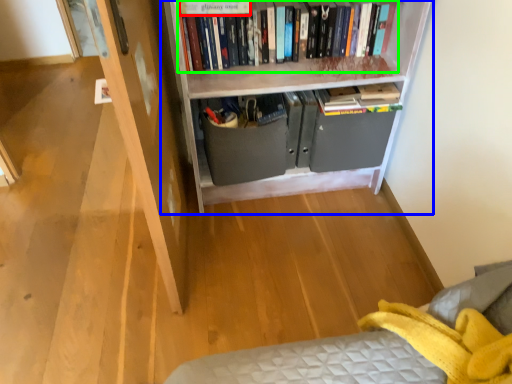
Question: Which is farther away from paperback book (highlighted by a red box)? bookcase (highlighted by a blue box) or book (highlighted by a green box)?

Choices:
 (A) bookcase
 (B) book

Answer: (A)